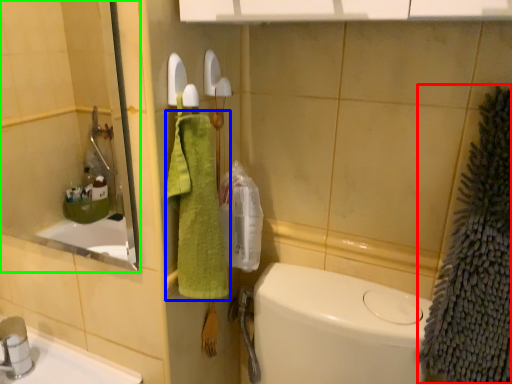
Question: Considering the real-world distances, which object is closest to bath towel (highlighted by a red box)? bath towel (highlighted by a blue box) or mirror (highlighted by a green box).

Choices:
 (A) bath towel
 (B) mirror

Answer: (A)